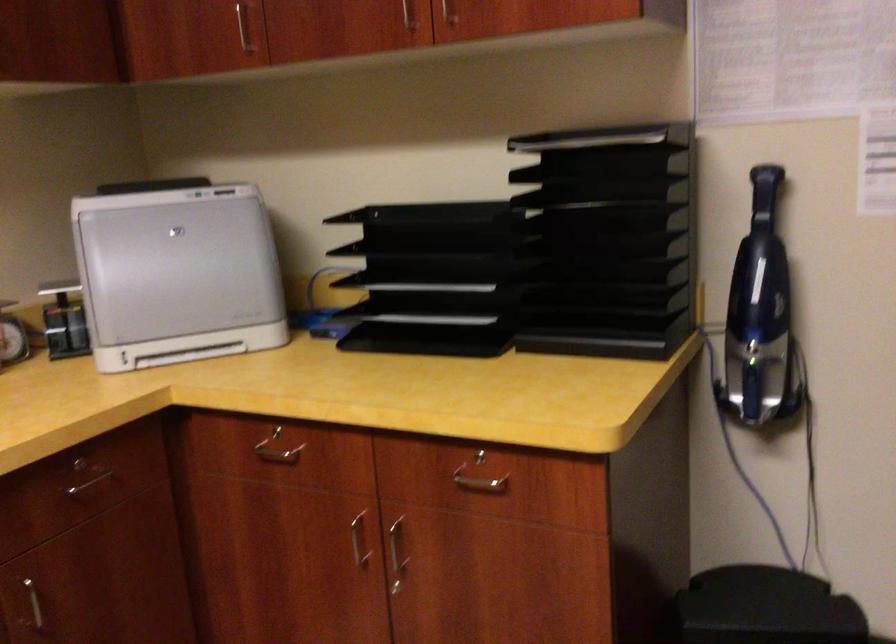
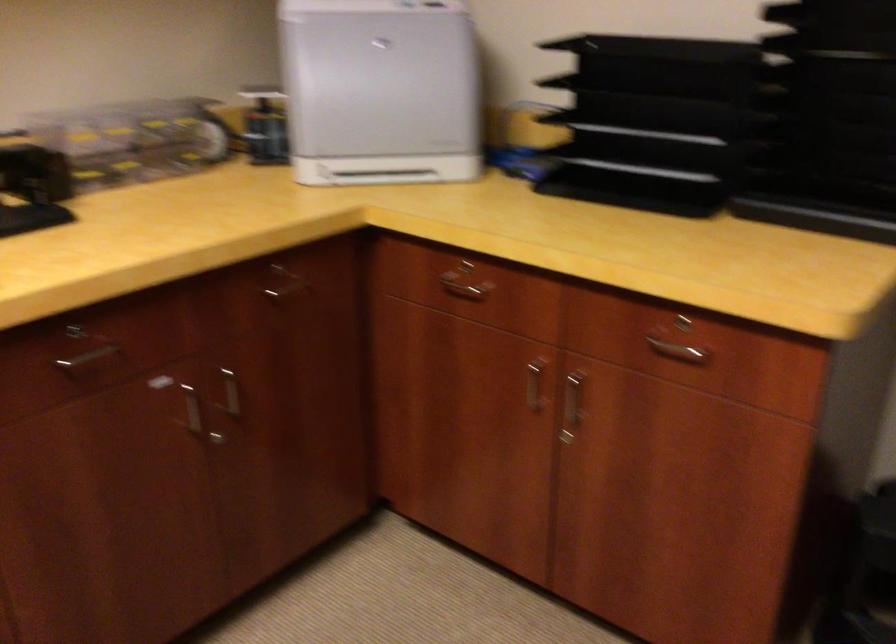
Question: The images are taken continuously from a first-person perspective. In which direction is your viewpoint rotating?

Choices:
 (A) Left
 (B) Right
 (C) Up
 (D) Down

Answer: (D)